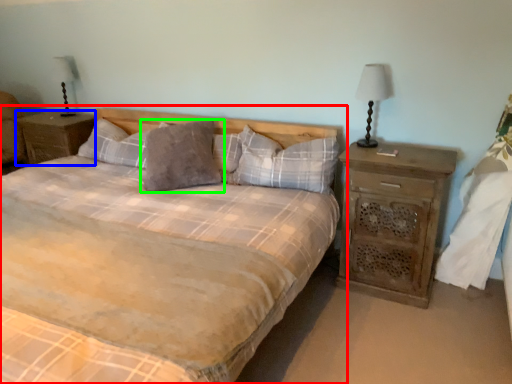
Question: Estimate the real-world distances between objects in this image. Which object is farther from bed (highlighted by a red box), nightstand (highlighted by a blue box) or pillow (highlighted by a green box)?

Choices:
 (A) nightstand
 (B) pillow

Answer: (A)